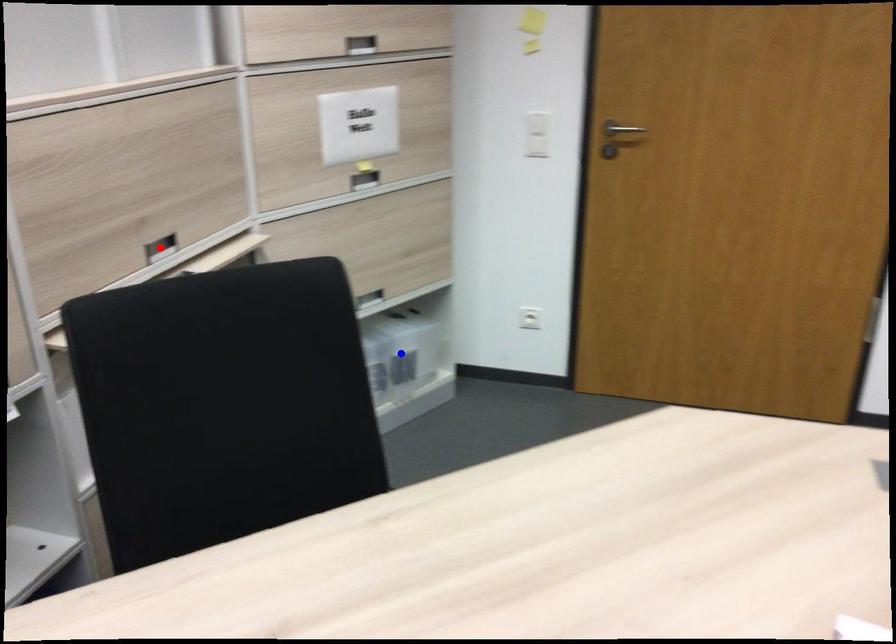
Question: Which of the two points in the image is closer to the camera?

Choices:
 (A) Blue point is closer.
 (B) Red point is closer.

Answer: (B)